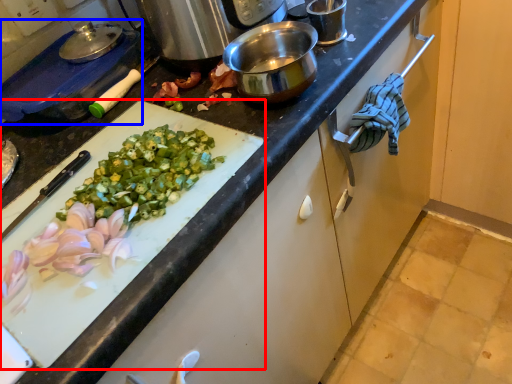
Question: Among these objects, which one is farthest to the camera, cutting board (highlighted by a red box) or kitchen appliance (highlighted by a blue box)?

Choices:
 (A) cutting board
 (B) kitchen appliance

Answer: (B)